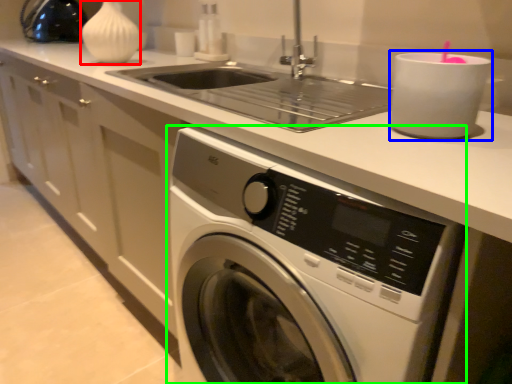
Question: Based on their relative distances, which object is nearer to vase (highlighted by a red box)? Choose from appliance (highlighted by a blue box) and washing machine (highlighted by a green box).

Choices:
 (A) appliance
 (B) washing machine

Answer: (B)